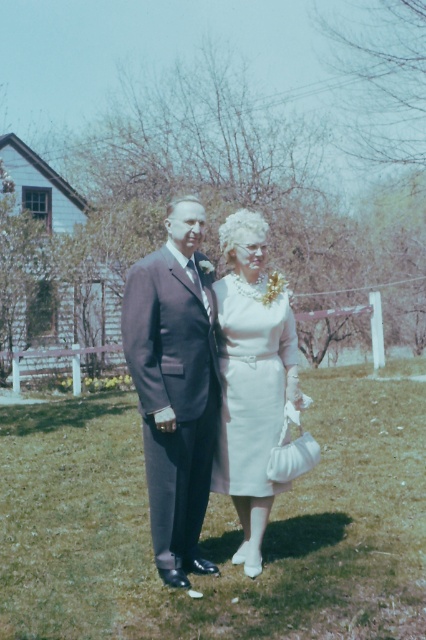
Question: Is matte black suit at center thinner than white satin dress at center?

Choices:
 (A) yes
 (B) no

Answer: (B)

Question: Can you confirm if matte black suit at center is positioned to the right of white satin dress at center?

Choices:
 (A) no
 (B) yes

Answer: (A)

Question: Which point appears closest to the camera in this image?

Choices:
 (A) (230, 474)
 (B) (163, 486)

Answer: (B)

Question: Does matte black suit at center appear under white satin dress at center?

Choices:
 (A) no
 (B) yes

Answer: (A)